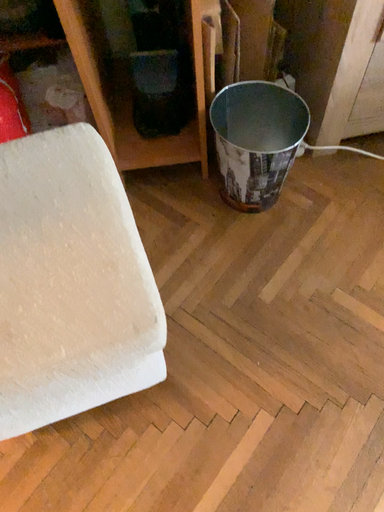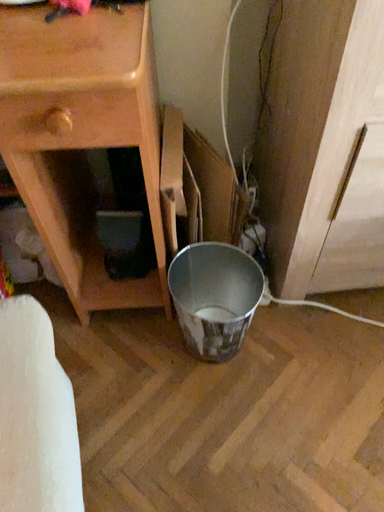
Question: Which way did the camera rotate in the video?

Choices:
 (A) rotated upward
 (B) rotated downward

Answer: (A)